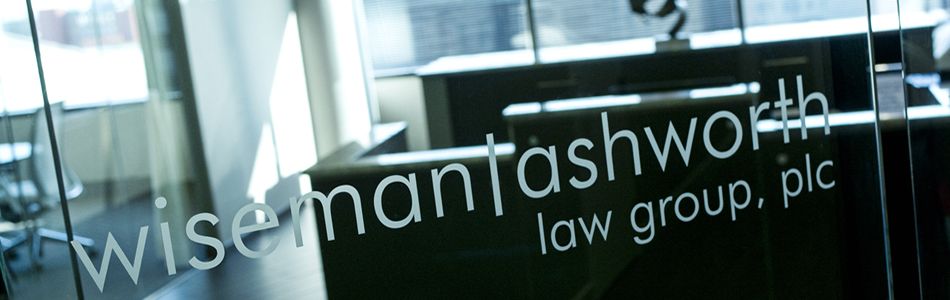
Where is `shorter table ledge`? shorter table ledge is located at coordinates (347, 151), (853, 113).